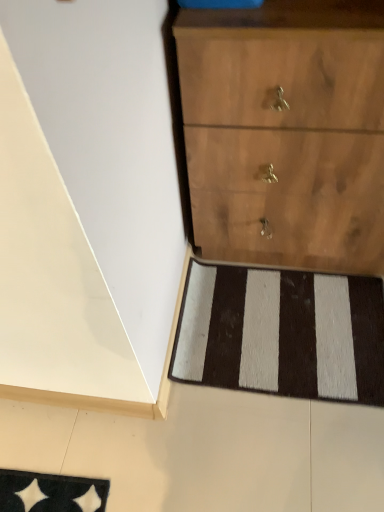
Question: Is wooden chest of drawers at center bigger or smaller than black/white striped rug at lower center?

Choices:
 (A) small
 (B) big

Answer: (B)

Question: Is point (375, 163) closer or farther from the camera than point (332, 287)?

Choices:
 (A) closer
 (B) farther

Answer: (A)

Question: In the image, is wooden chest of drawers at center on the left side or the right side of black/white striped rug at lower center?

Choices:
 (A) left
 (B) right

Answer: (B)

Question: Considering the positions of black/white striped rug at lower center and wooden chest of drawers at center in the image, is black/white striped rug at lower center wider or thinner than wooden chest of drawers at center?

Choices:
 (A) wide
 (B) thin

Answer: (A)

Question: Is point (190, 365) positioned closer to the camera than point (370, 254)?

Choices:
 (A) farther
 (B) closer

Answer: (B)

Question: From their relative heights in the image, would you say black/white striped rug at lower center is taller or shorter than wooden chest of drawers at center?

Choices:
 (A) tall
 (B) short

Answer: (B)

Question: Is black/white striped rug at lower center to the left or to the right of wooden chest of drawers at center in the image?

Choices:
 (A) left
 (B) right

Answer: (A)